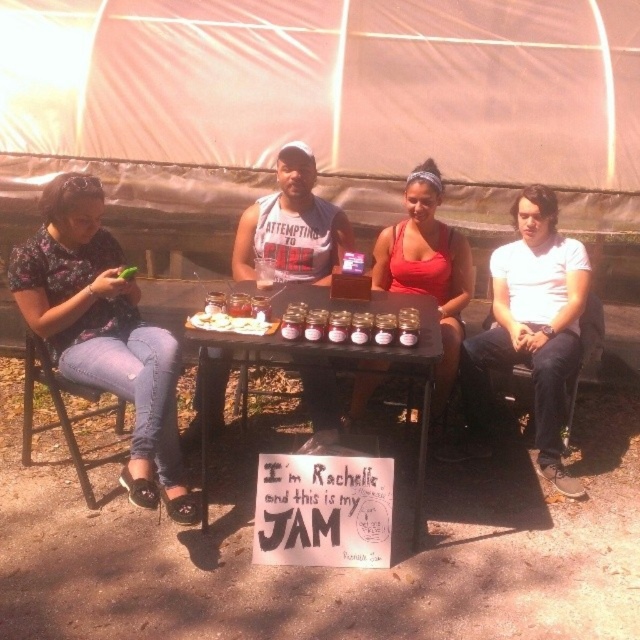
Question: Estimate the real-world distances between objects in this image. Which object is farther from the white creamy cheese at table center?

Choices:
 (A) wooden table at center
 (B) floral fabric shirt at left
 (C) white cotton shirt at right

Answer: (C)

Question: Which of the following is the closest to the observer?

Choices:
 (A) (118, 276)
 (B) (568, 276)
 (C) (161, 364)
 (D) (275, 339)

Answer: (D)

Question: Does floral fabric shirt at left lie behind white creamy spread at center?

Choices:
 (A) no
 (B) yes

Answer: (A)

Question: Does wooden table at center appear on the right side of white creamy cheese at table center?

Choices:
 (A) no
 (B) yes

Answer: (B)

Question: Which point is farther to the camera?

Choices:
 (A) (294, 344)
 (B) (234, 332)

Answer: (B)

Question: Where is floral fabric shirt at left located in relation to white creamy spread at center in the image?

Choices:
 (A) above
 (B) below

Answer: (B)